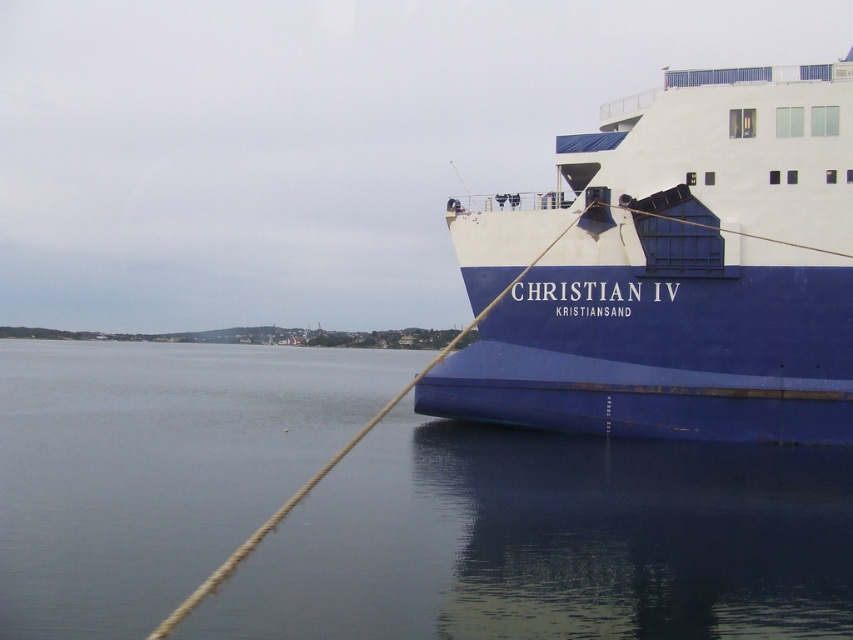
Question: Is blue water at lower left behind blue matte ship at right?

Choices:
 (A) yes
 (B) no

Answer: (B)

Question: Which object is positioned closest to the blue matte ship at right?

Choices:
 (A) blue water at lower left
 (B) rope at right

Answer: (B)

Question: Which of the following is the farthest from the observer?

Choices:
 (A) blue matte ship at right
 (B) blue water at lower left

Answer: (A)

Question: Can you confirm if blue water at lower left is positioned to the right of blue matte ship at right?

Choices:
 (A) yes
 (B) no

Answer: (B)

Question: Is blue water at lower left positioned before rope at right?

Choices:
 (A) yes
 (B) no

Answer: (B)

Question: Which of the following is the farthest from the observer?

Choices:
 (A) blue water at lower left
 (B) blue matte ship at right

Answer: (B)